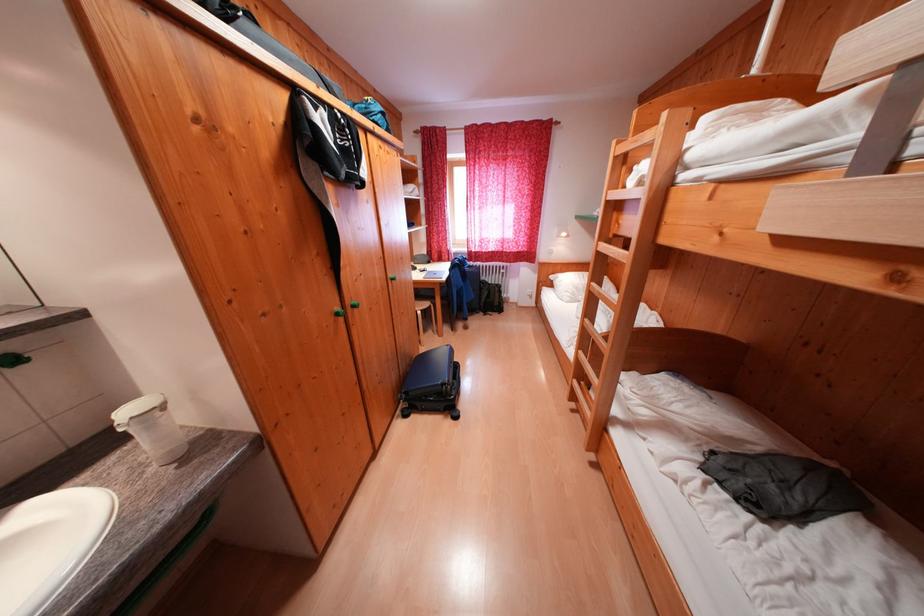
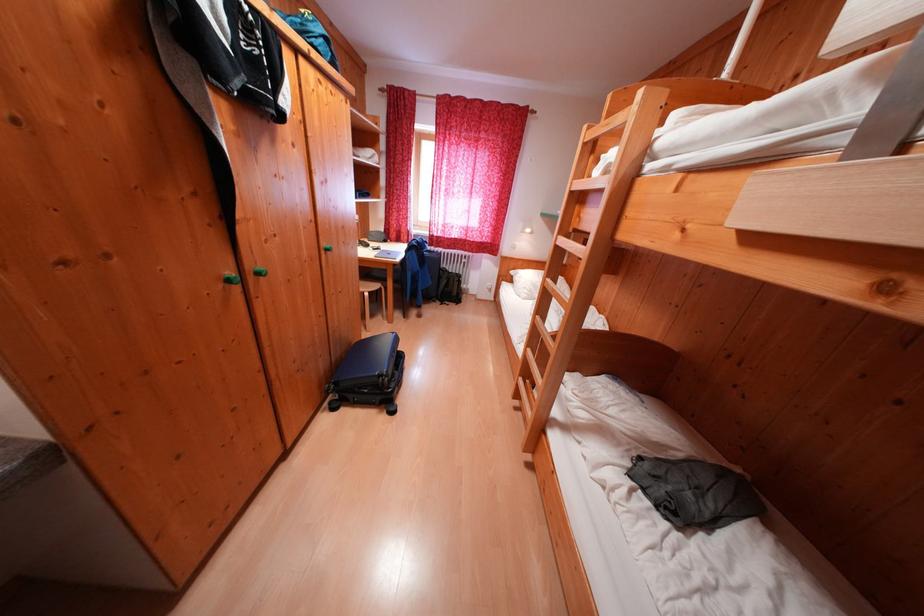
Question: The first image is from the beginning of the video and the second image is from the end. How did the camera likely rotate when shooting the video?

Choices:
 (A) Left
 (B) Right
 (C) Up
 (D) Down

Answer: (B)